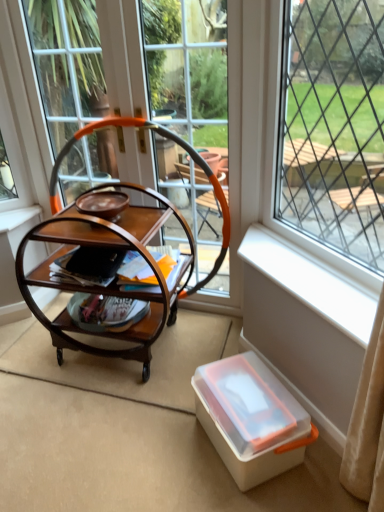
Question: Considering the relative sizes of matte brown magazine at center and wooden trolley at center in the image provided, is matte brown magazine at center thinner than wooden trolley at center?

Choices:
 (A) yes
 (B) no

Answer: (A)

Question: Would you say matte brown magazine at center is outside wooden trolley at center?

Choices:
 (A) yes
 (B) no

Answer: (B)

Question: Is matte brown magazine at center smaller than wooden trolley at center?

Choices:
 (A) no
 (B) yes

Answer: (B)

Question: Is matte brown magazine at center further to camera compared to wooden trolley at center?

Choices:
 (A) yes
 (B) no

Answer: (A)

Question: From the image's perspective, is matte brown magazine at center beneath wooden trolley at center?

Choices:
 (A) yes
 (B) no

Answer: (B)

Question: In the image, is translucent plastic box at lower right positioned in front of or behind white plastic window sill at lower right?

Choices:
 (A) behind
 (B) front

Answer: (A)

Question: Is point (198, 409) closer or farther from the camera than point (243, 268)?

Choices:
 (A) closer
 (B) farther

Answer: (A)

Question: From a real-world perspective, is translucent plastic box at lower right physically located above or below white plastic window sill at lower right?

Choices:
 (A) above
 (B) below

Answer: (B)

Question: Is translucent plastic box at lower right taller or shorter than white plastic window sill at lower right?

Choices:
 (A) tall
 (B) short

Answer: (A)

Question: Is point (89, 203) closer or farther from the camera than point (362, 152)?

Choices:
 (A) closer
 (B) farther

Answer: (A)

Question: Is matte brown plate at center inside or outside of transparent plastic window at center, the 1th window viewed from the right?

Choices:
 (A) inside
 (B) outside

Answer: (B)

Question: Considering the relative positions of matte brown plate at center and transparent plastic window at center, the 1th window viewed from the right, in the image provided, is matte brown plate at center to the left or to the right of transparent plastic window at center, the 1th window viewed from the right,?

Choices:
 (A) right
 (B) left

Answer: (B)

Question: Considering the positions of matte brown plate at center and transparent plastic window at center, the 1th window viewed from the right, in the image, is matte brown plate at center wider or thinner than transparent plastic window at center, the 1th window viewed from the right,?

Choices:
 (A) thin
 (B) wide

Answer: (A)

Question: Is wooden/marble-like rocking chair at center bigger or smaller than clear glass window at center, which appears as the first window when viewed from the left?

Choices:
 (A) small
 (B) big

Answer: (A)

Question: Does point (89, 131) appear closer or farther from the camera than point (357, 271)?

Choices:
 (A) farther
 (B) closer

Answer: (A)